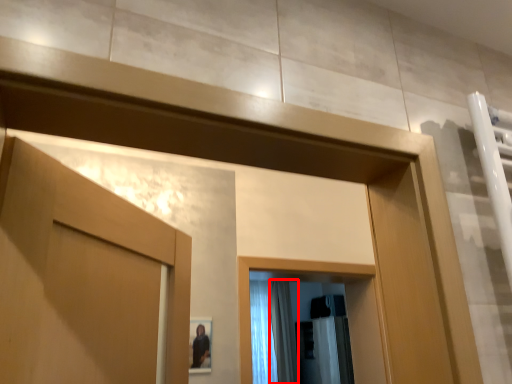
Question: Where is shower curtain (annotated by the red box) located in relation to shower curtain in the image?

Choices:
 (A) right
 (B) left

Answer: (A)